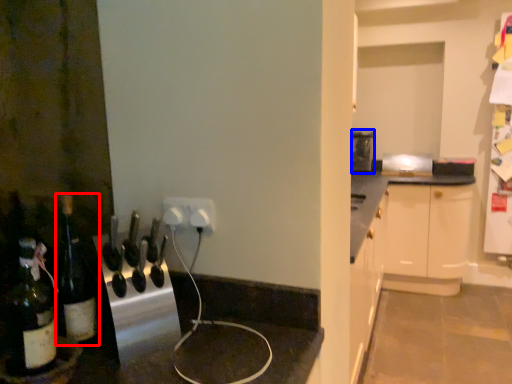
Question: Among these objects, which one is nearest to the camera, bottle (highlighted by a red box) or appliance (highlighted by a blue box)?

Choices:
 (A) bottle
 (B) appliance

Answer: (A)